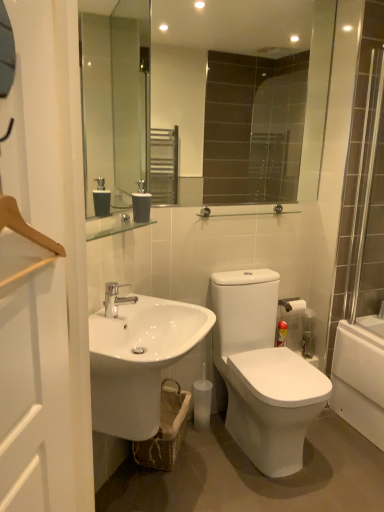
Question: Are clear glass rail at upper center and white matte toilet paper at right making contact?

Choices:
 (A) yes
 (B) no

Answer: (B)

Question: Can you confirm if clear glass rail at upper center is taller than white matte toilet paper at right?

Choices:
 (A) yes
 (B) no

Answer: (B)

Question: Is clear glass rail at upper center behind white matte toilet paper at right?

Choices:
 (A) no
 (B) yes

Answer: (A)

Question: Considering the relative sizes of clear glass rail at upper center and white matte toilet paper at right in the image provided, is clear glass rail at upper center thinner than white matte toilet paper at right?

Choices:
 (A) no
 (B) yes

Answer: (B)

Question: Is clear glass rail at upper center not inside white matte toilet paper at right?

Choices:
 (A) yes
 (B) no

Answer: (A)

Question: In terms of width, does silver metallic faucet at center look wider or thinner when compared to white glossy sink at lower left?

Choices:
 (A) thin
 (B) wide

Answer: (A)

Question: In the image, is silver metallic faucet at center on the left side or the right side of white glossy sink at lower left?

Choices:
 (A) left
 (B) right

Answer: (A)

Question: Looking at the image, does silver metallic faucet at center seem bigger or smaller compared to white glossy sink at lower left?

Choices:
 (A) small
 (B) big

Answer: (A)

Question: Is silver metallic faucet at center taller or shorter than white glossy sink at lower left?

Choices:
 (A) tall
 (B) short

Answer: (B)

Question: Based on their positions, is silver metallic shower door at right located to the left or right of glossy glass mirror at upper center?

Choices:
 (A) left
 (B) right

Answer: (B)

Question: From the image's perspective, is silver metallic shower door at right positioned above or below glossy glass mirror at upper center?

Choices:
 (A) below
 (B) above

Answer: (A)

Question: Based on their sizes in the image, would you say silver metallic shower door at right is bigger or smaller than glossy glass mirror at upper center?

Choices:
 (A) small
 (B) big

Answer: (A)

Question: Is silver metallic shower door at right taller or shorter than glossy glass mirror at upper center?

Choices:
 (A) tall
 (B) short

Answer: (A)

Question: Visually, is silver metallic faucet at center positioned to the left or to the right of matte gray soap dispenser at center?

Choices:
 (A) left
 (B) right

Answer: (A)

Question: Is point (115, 283) closer or farther from the camera than point (140, 195)?

Choices:
 (A) farther
 (B) closer

Answer: (A)